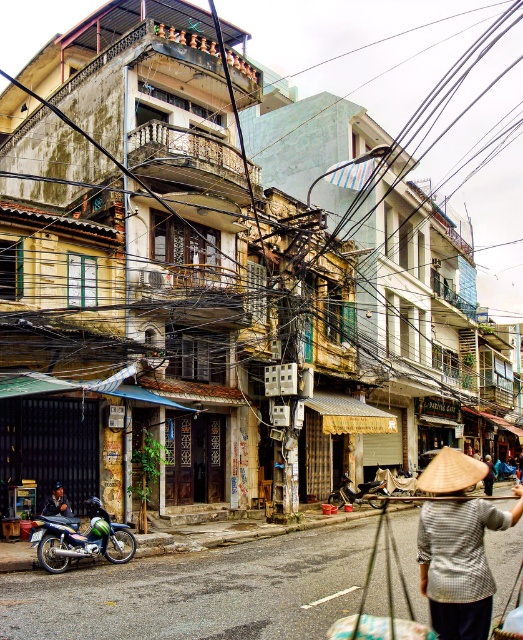
You are a delivery person who needs to pick up a package from a storage box that is 1.2 meters wide. You see the natural straw hat at center and the green matte motorcycle at center in the scene. Can the storage box fit between these two items without overlapping them?

The natural straw hat at center might be wider than green matte motorcycle at center, so the storage box that is 1.2 meters wide may not fit between them if the space between the two is narrower than 1.2 meters. However, since the exact distance isn

You are standing on the street and want to take a photo that includes both point (8, 125) and point (336, 497). Which point should you focus on first to ensure both are in focus?

You should focus on point (336, 497) first because it is closer to the camera than point (8, 125), which is further away. By focusing on the closer point, the further one will also be in focus due to depth of field.